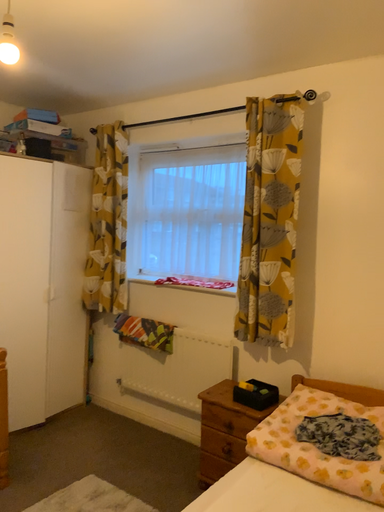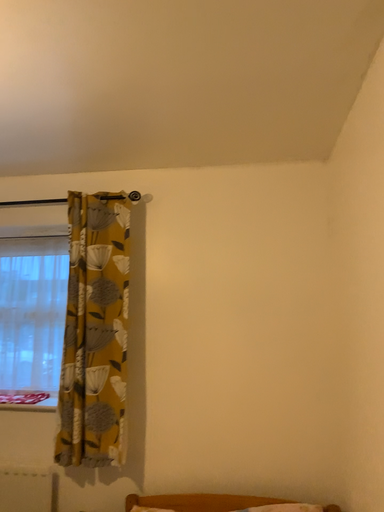
Question: How did the camera likely rotate when shooting the video?

Choices:
 (A) rotated upward
 (B) rotated downward

Answer: (A)